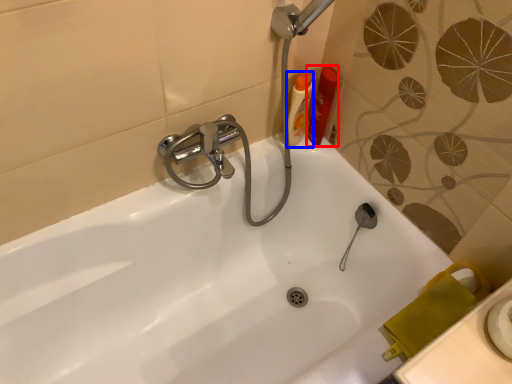
Question: Which object is closer to the camera taking this photo, toiletry (highlighted by a red box) or toiletry (highlighted by a blue box)?

Choices:
 (A) toiletry
 (B) toiletry

Answer: (B)